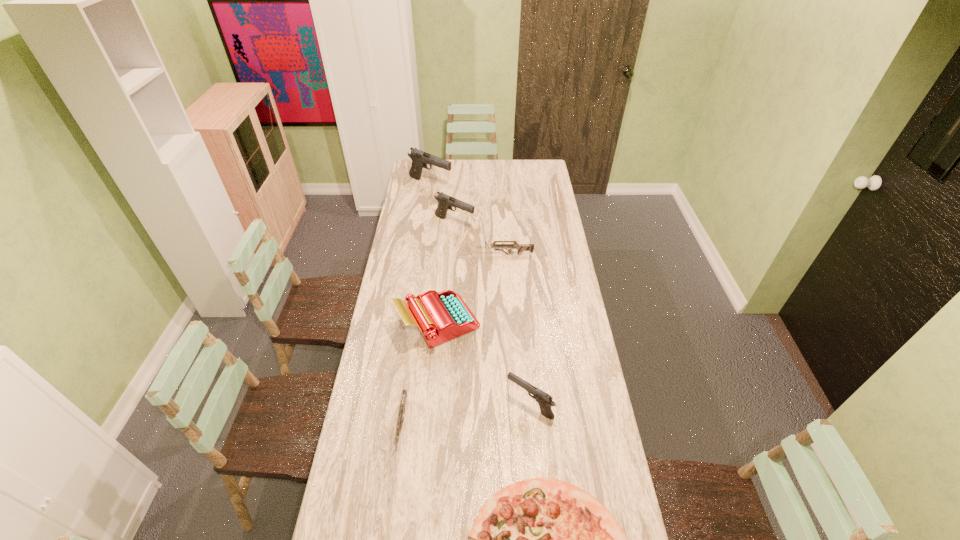
This screenshot has height=540, width=960. In order to click on vacant space in between the farthest gun and the typewriter in this screenshot , I will do `click(434, 253)`.

The image size is (960, 540). In order to click on vacant area that lies between the nearest black gun and the typewriter in this screenshot , I will do `click(484, 363)`.

This screenshot has height=540, width=960. In order to click on free space that is in between the sixth tallest object and the right grey gun in this screenshot , I will do `click(454, 340)`.

Find the location of a particular element. object that stands as the third closest to the typewriter is located at coordinates (498, 247).

Identify the location of object that can be found as the fourth closest to the farthest object. (544, 400).

Point out which gun is positioned as the nearest to the third tallest gun. Please provide its 2D coordinates. Your answer should be formatted as a tuple, i.e. [(x, y)], where the tuple contains the x and y coordinates of a point satisfying the conditions above.

[(404, 394)]

Find the location of `gun that is the closest one to the second shortest object`. gun that is the closest one to the second shortest object is located at coordinates (544, 400).

Select which black gun is the second closest to the fourth shortest object. Please provide its 2D coordinates. Your answer should be formatted as a tuple, i.e. [(x, y)], where the tuple contains the x and y coordinates of a point satisfying the conditions above.

[(420, 159)]

Where is `black gun that is the second closest one to the typewriter`? black gun that is the second closest one to the typewriter is located at coordinates (445, 202).

Point out which grey gun is positioned as the second nearest to the smallest black gun. Please provide its 2D coordinates. Your answer should be formatted as a tuple, i.e. [(x, y)], where the tuple contains the x and y coordinates of a point satisfying the conditions above.

[(498, 247)]